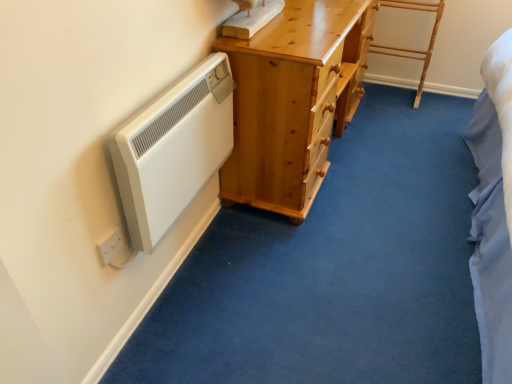
The width and height of the screenshot is (512, 384). I want to click on free space to the right of light brown wooden chest of drawers at center, so click(x=400, y=144).